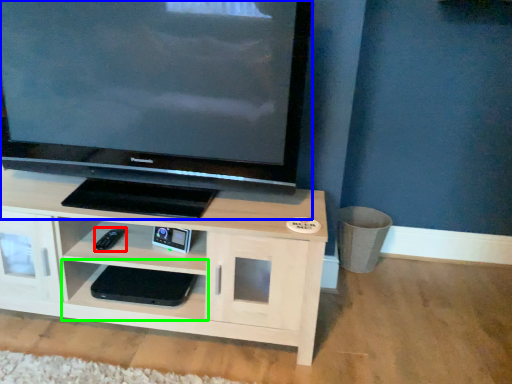
Question: Which object is positioned farthest from remote (highlighted by a red box)? Select from television (highlighted by a blue box) and shelf (highlighted by a green box).

Choices:
 (A) television
 (B) shelf

Answer: (A)